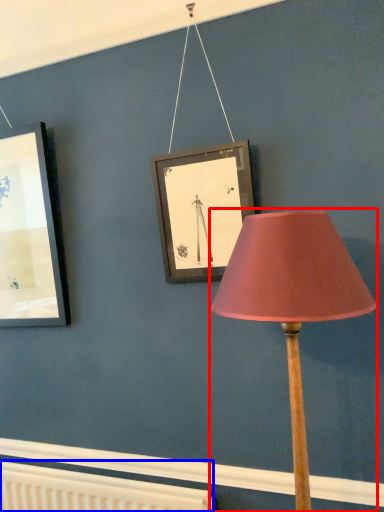
Question: Among these objects, which one is farthest to the camera, lamp (highlighted by a red box) or radiator (highlighted by a blue box)?

Choices:
 (A) lamp
 (B) radiator

Answer: (B)